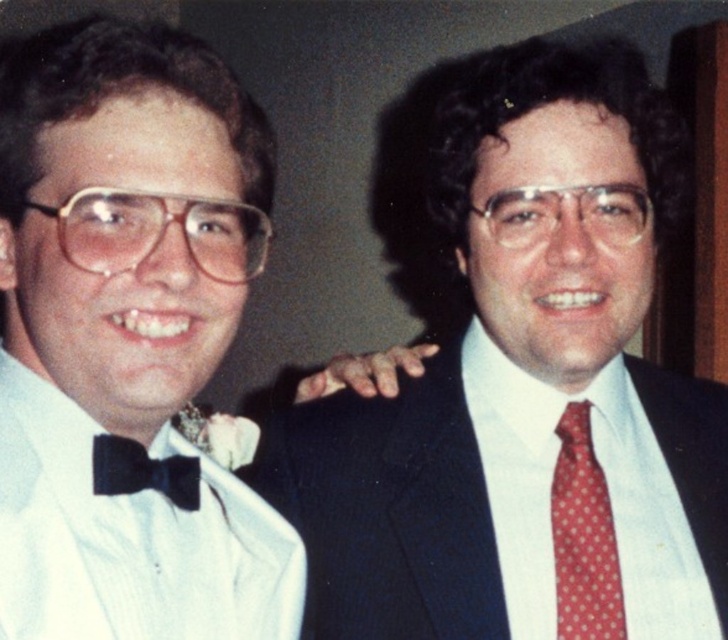
Which is behind, point (577, 634) or point (146, 465)?

Point (577, 634)

You are a GUI agent. You are given a task and a screenshot of the screen. Output one action in this format:
    pyautogui.click(x=<x>, y=<y>)
    Task: Click on the red dotted fabric tie at right
    
    Given the screenshot: What is the action you would take?
    pyautogui.click(x=582, y=536)

Is point (712, 406) closer to camera compared to point (181, 468)?

That is False.

Can you confirm if white satin bow tie at left is positioned below black satin bow tie at left?

Incorrect, white satin bow tie at left is not positioned below black satin bow tie at left.

Measure the distance between white satin bow tie at left and camera.

The distance of white satin bow tie at left from camera is 30.16 inches.

Locate an element on the screen. white satin bow tie at left is located at coordinates (526, 394).

Is point (482, 321) closer to viewer compared to point (585, 408)?

That is False.

Does white satin bow tie at left have a greater height compared to red dotted fabric tie at right?

Yes, white satin bow tie at left is taller than red dotted fabric tie at right.

Identify the location of white satin bow tie at left. (526, 394).